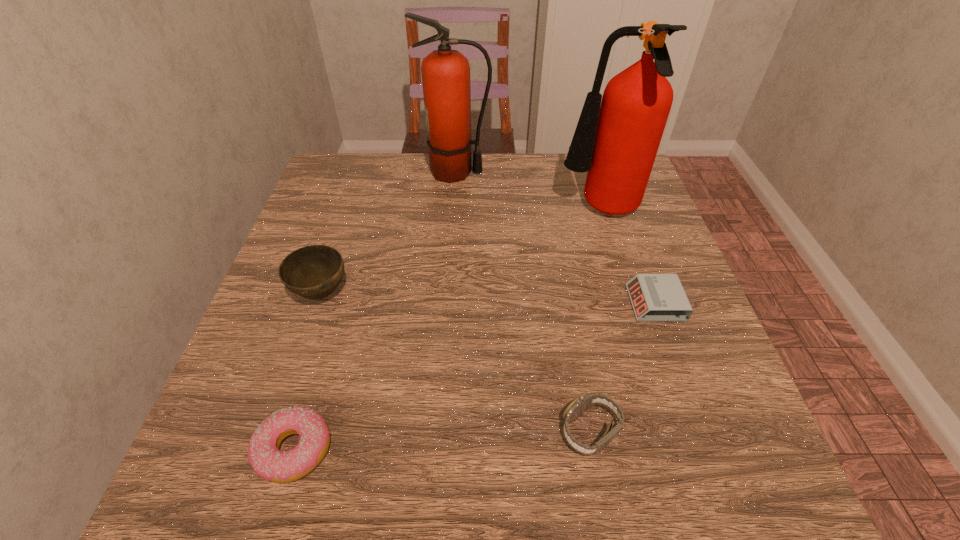
The width and height of the screenshot is (960, 540). I want to click on free space located at the nozzle of the fifth nearest object, so click(x=481, y=211).

Identify the location of vacant space located 0.180m on the nozzle of the left fire extinguisher. 556,173.

Locate an element on the screen. vacant point located on the front of the bowl is located at coordinates (252, 500).

Find the location of a particular element. The image size is (960, 540). blank space located 0.290m on the face of the watch is located at coordinates (377, 431).

I want to click on free space located 0.380m on the face of the watch, so click(x=320, y=431).

Where is `free space located 0.100m on the face of the watch`? The height and width of the screenshot is (540, 960). free space located 0.100m on the face of the watch is located at coordinates (497, 431).

The image size is (960, 540). In order to click on free region located on the back of the doughnut in this screenshot , I will do `click(351, 255)`.

The image size is (960, 540). Identify the location of vacant space located on the front of the shortest object. (x=673, y=353).

Where is `watch that is at the near edge`? The height and width of the screenshot is (540, 960). watch that is at the near edge is located at coordinates (581, 403).

You are a GUI agent. You are given a task and a screenshot of the screen. Output one action in this format:
    pyautogui.click(x=<x>, y=<y>)
    Task: Click on the doughnut present at the near edge
    This screenshot has width=960, height=540.
    Given the screenshot: What is the action you would take?
    pyautogui.click(x=271, y=464)